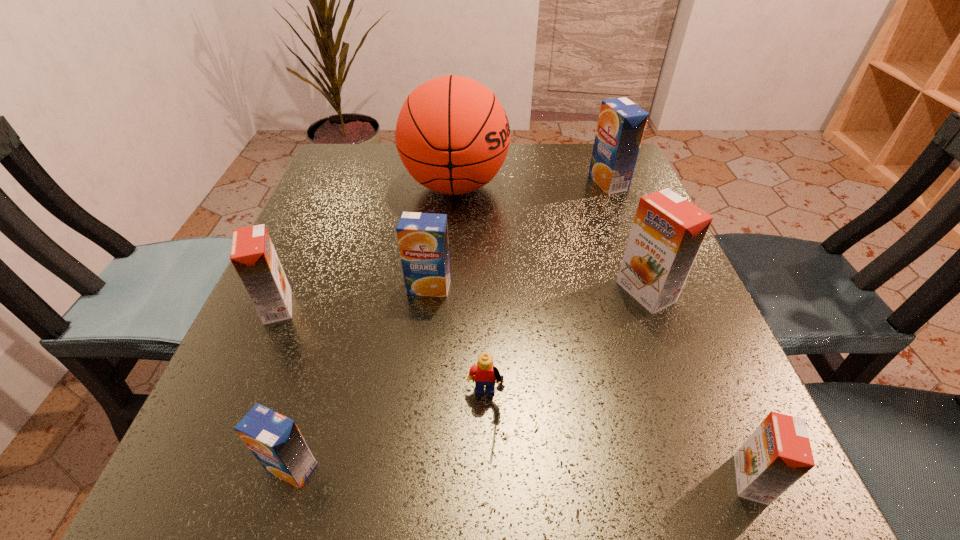
Find the location of `vacant space located on the back of the smallest orange orange juice`. vacant space located on the back of the smallest orange orange juice is located at coordinates (691, 342).

Where is `basketball present at the far edge`? This screenshot has width=960, height=540. basketball present at the far edge is located at coordinates (452, 134).

Image resolution: width=960 pixels, height=540 pixels. I want to click on orange_juice situated at the far edge, so click(x=621, y=124).

This screenshot has width=960, height=540. What are the coordinates of `object at the near left corner` in the screenshot? It's located at (275, 440).

I want to click on object located at the far right corner, so click(x=621, y=124).

Locate an element on the screen. This screenshot has width=960, height=540. object at the near right corner is located at coordinates (778, 453).

Image resolution: width=960 pixels, height=540 pixels. In the image, there is a desktop. What are the coordinates of `free region at the far edge` in the screenshot? It's located at (399, 158).

The image size is (960, 540). In the image, there is a desktop. Identify the location of vacant space at the near edge. click(x=534, y=502).

Locate an element on the screen. This screenshot has height=540, width=960. vacant space at the left edge of the desktop is located at coordinates (345, 293).

Find the location of `vacant space at the right edge of the desktop`. vacant space at the right edge of the desktop is located at coordinates (633, 223).